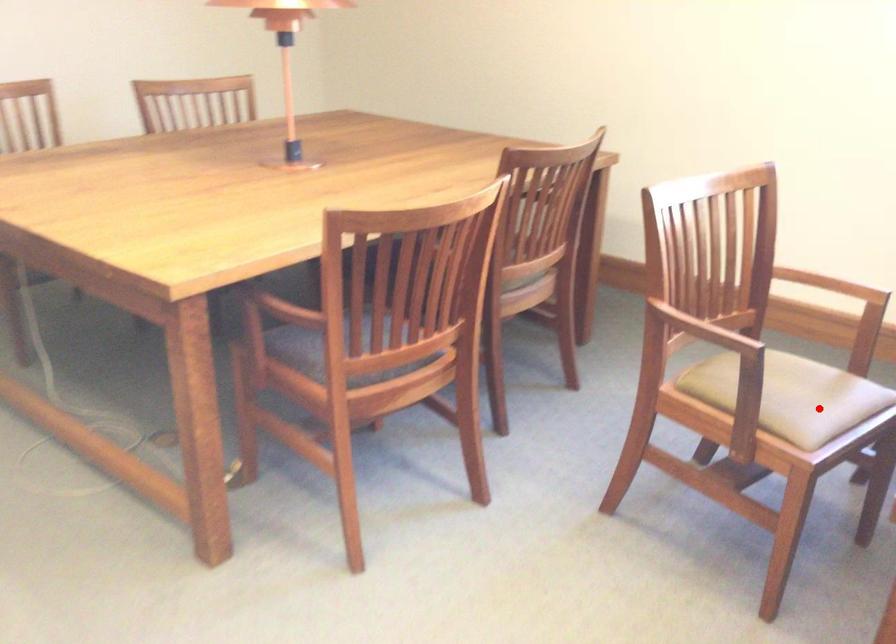
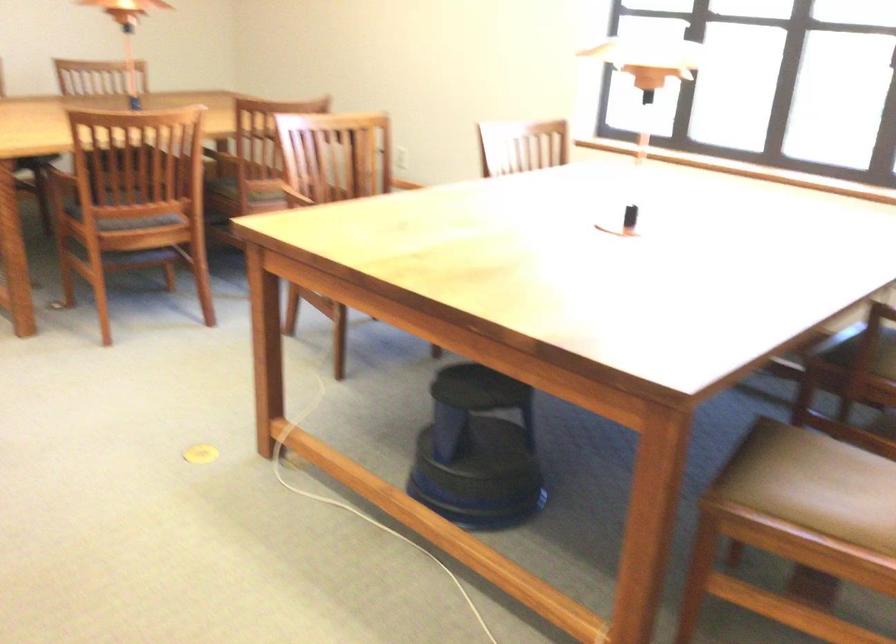
Question: I am providing you with two images of the same scene from different viewpoints. A red point is marked on the first image. Can you still see the location of the red point in image 2?

Choices:
 (A) Yes
 (B) No

Answer: (B)